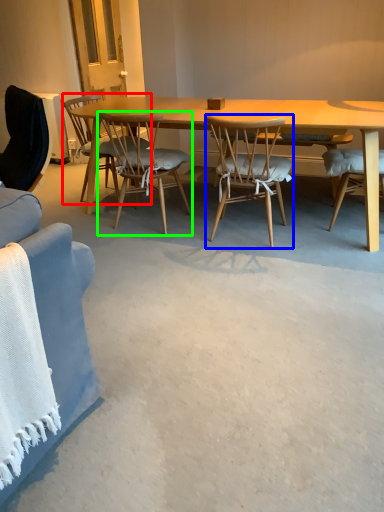
Question: Based on their relative distances, which object is farther from chair (highlighted by a red box)? Choose from chair (highlighted by a blue box) and chair (highlighted by a green box).

Choices:
 (A) chair
 (B) chair

Answer: (A)